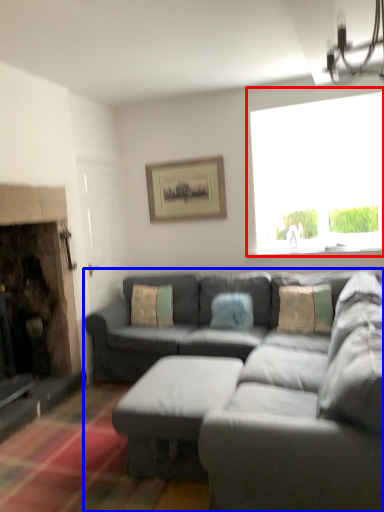
Question: Among these objects, which one is nearest to the camera, window (highlighted by a red box) or studio couch (highlighted by a blue box)?

Choices:
 (A) window
 (B) studio couch

Answer: (B)